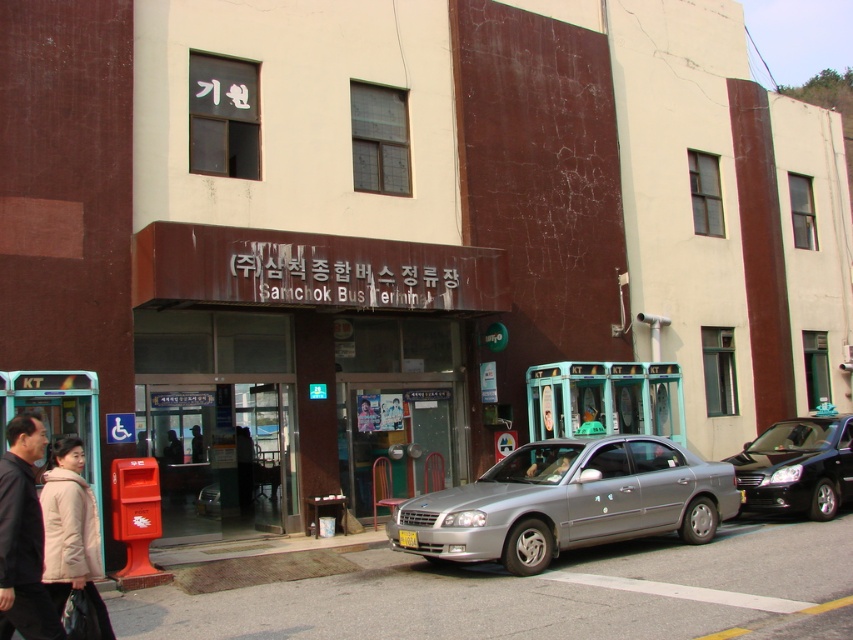
Question: Does brown matte signboard at center have a lesser width compared to black matte jacket at lower left?

Choices:
 (A) yes
 (B) no

Answer: (A)

Question: Is brown matte signboard at center smaller than green plastic man at center?

Choices:
 (A) no
 (B) yes

Answer: (B)

Question: Which of the following is the farthest from the observer?

Choices:
 (A) pos(766,504)
 (B) pos(47,636)
 (C) pos(71,548)
 (D) pos(294,364)

Answer: (D)

Question: Which of the following is the farthest from the observer?

Choices:
 (A) brown matte signboard at center
 (B) green plastic man at center

Answer: (A)

Question: Which of the following is the closest to the observer?

Choices:
 (A) (814, 451)
 (B) (90, 563)
 (C) (651, 440)
 (D) (202, 387)

Answer: (B)

Question: Is the position of shiny black sedan at center less distant than that of green plastic man at center?

Choices:
 (A) no
 (B) yes

Answer: (B)